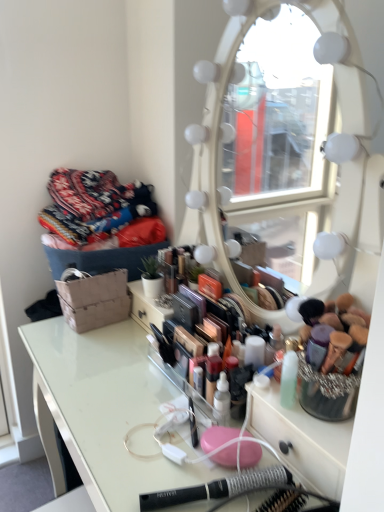
You are a GUI agent. You are given a task and a screenshot of the screen. Output one action in this format:
    pyautogui.click(x=<x>, y=<y>)
    Task: Click on the free space above clear acrylic table at center (from a real-world perspective)
    The width and height of the screenshot is (384, 512).
    Given the screenshot: What is the action you would take?
    pyautogui.click(x=127, y=373)